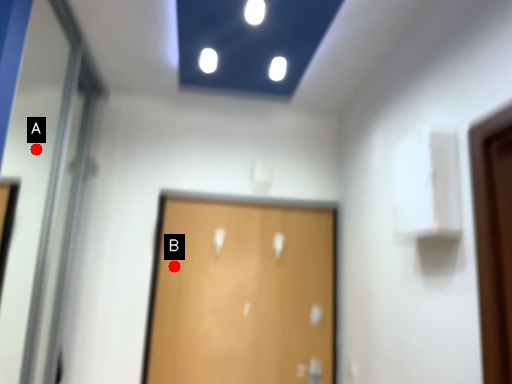
Question: Two points are circled on the image, labeled by A and B beside each circle. Which point appears farthest from the camera in this image?

Choices:
 (A) A is further
 (B) B is further

Answer: (A)